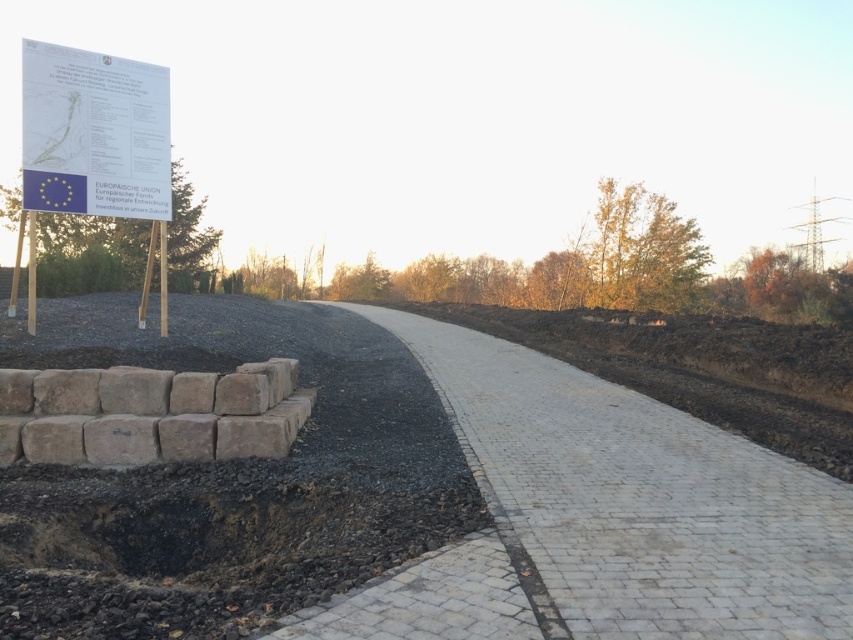
Is brown stone wall at lower left above white paper sign at upper left?

No, brown stone wall at lower left is not above white paper sign at upper left.

Between brown stone wall at lower left and white paper sign at upper left, which one is positioned higher?

white paper sign at upper left

Find the location of a particular element. brown stone wall at lower left is located at coordinates (149, 413).

Which of these two, black gravel at lower left or white brick pavement at center, stands shorter?

Standing shorter between the two is white brick pavement at center.

Identify the location of black gravel at lower left. (228, 481).

Which is above, white brick pavement at center or brown stone wall at lower left?

brown stone wall at lower left is above.

Does white brick pavement at center appear on the left side of brown stone wall at lower left?

Incorrect, white brick pavement at center is not on the left side of brown stone wall at lower left.

Does point (614, 509) come in front of point (91, 406)?

Yes, it is.

The width and height of the screenshot is (853, 640). I want to click on white brick pavement at center, so click(608, 515).